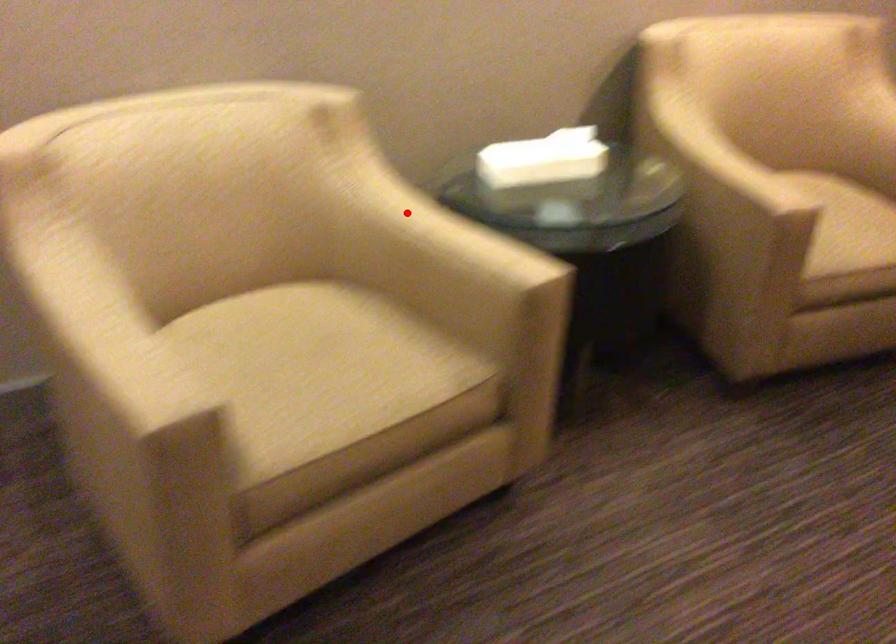
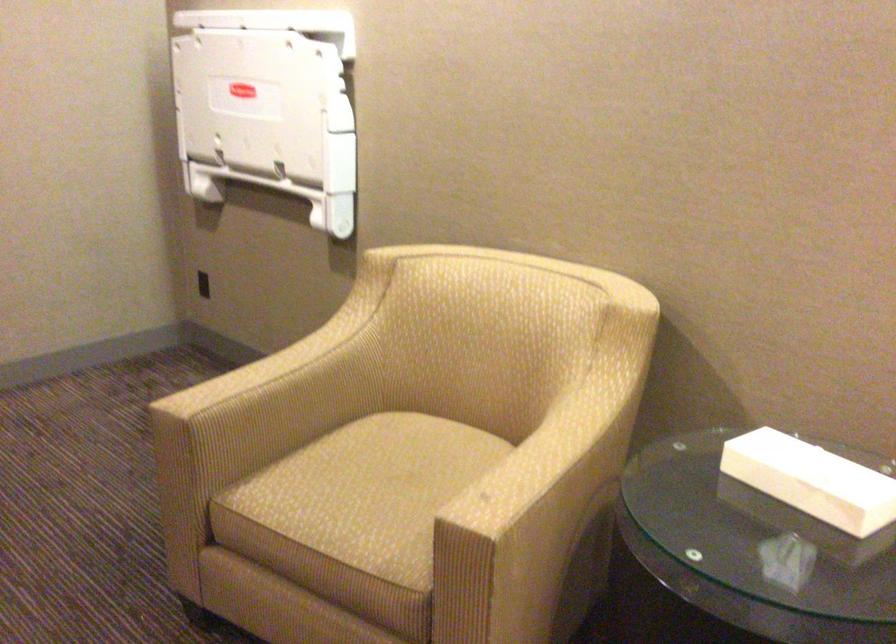
Locate, in the second image, the point that corresponds to the highlighted location in the first image.

(565, 426)